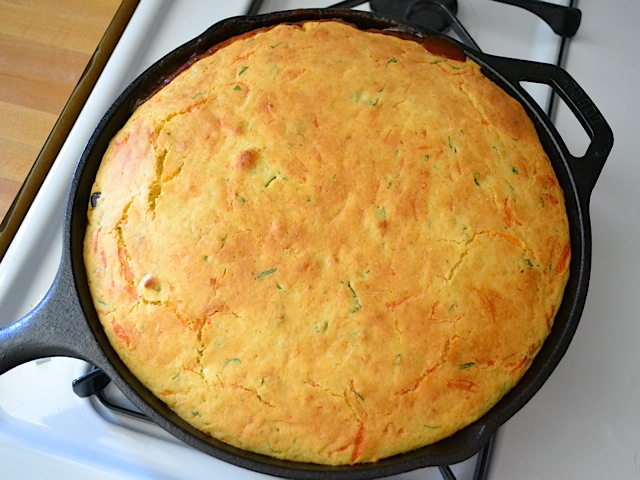
You are a GUI agent. You are given a task and a screenshot of the screen. Output one action in this format:
    pyautogui.click(x=<x>, y=<y>)
    Task: Click on the stove burner
    This screenshot has height=480, width=640.
    Given the screenshot: What is the action you would take?
    pyautogui.click(x=426, y=15)